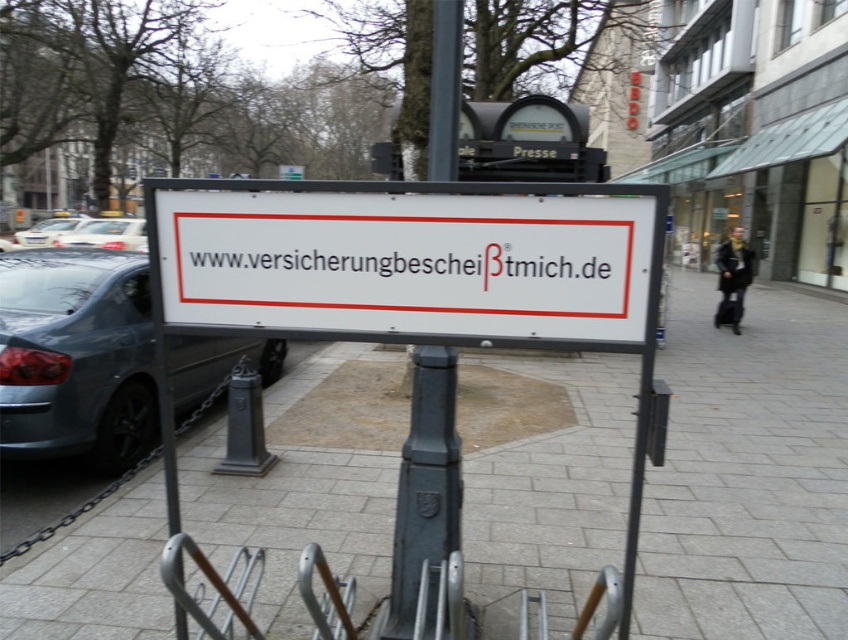
You are driving a car and need to park in the parking lot. You see a dark gray metal pole at center and a white glossy car at left. Which object is closer to you as you approach the parking area?

The dark gray metal pole at center is closer to you because it is in front of the white glossy car at left, meaning the pole is positioned between you and the car.

You are a delivery person who needs to park your bike on the white concrete pavement at center. However, there is a matte gray car at left blocking the path. Based on the scene description, can you safely navigate around the car to reach the pavement?

The white concrete pavement at center is below the matte gray car at left, meaning the car is positioned higher up or in front of the pavement. To safely navigate around the car, you would need to go around it either to the left or right side, ensuring there is enough space to maneuver your bike without obstruction. Since the car is blocking the direct path, you must choose a side where there is clearance. However, without additional information about the surrounding area or the exact positioning of the car

You are a delivery person with a 3.5 feet wide cart. You need to move from the white concrete pavement at center to the matte gray car at left. Is there enough space for your cart to pass between them?

The white concrete pavement at center and matte gray car at left are 9.20 feet apart, so yes, the cart can pass between them since 9.20 feet is wider than the cart.